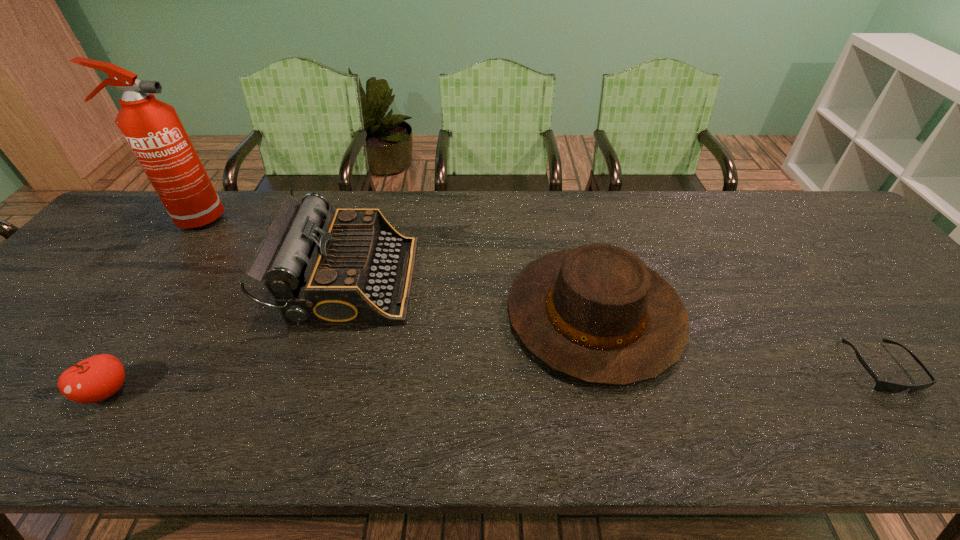
The width and height of the screenshot is (960, 540). Identify the location of free space at the far edge. (635, 204).

Locate an element on the screen. This screenshot has width=960, height=540. vacant space at the near edge is located at coordinates (797, 422).

In the image, there is a desktop. Find the location of `free region at the right edge`. free region at the right edge is located at coordinates (916, 299).

The width and height of the screenshot is (960, 540). I want to click on vacant space at the far right corner of the desktop, so click(x=783, y=198).

Identify the location of vacant area that lies between the apple and the typewriter. (228, 335).

Image resolution: width=960 pixels, height=540 pixels. Find the location of `free space between the apple and the third object from left to right`. free space between the apple and the third object from left to right is located at coordinates (228, 335).

In order to click on vacant area that lies between the second object from right to left and the shortest object in this screenshot , I will do `click(737, 341)`.

The image size is (960, 540). I want to click on empty location between the third object from right to left and the cowboy hat, so click(472, 297).

Point out which object is positioned as the second nearest to the shortest object. Please provide its 2D coordinates. Your answer should be formatted as a tuple, i.e. [(x, y)], where the tuple contains the x and y coordinates of a point satisfying the conditions above.

[(350, 266)]

Identify the location of object that is the third closest one to the cowboy hat. (94, 379).